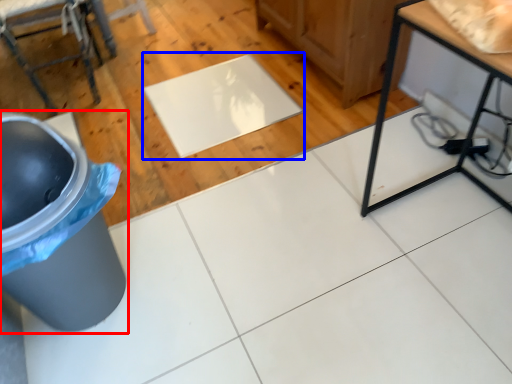
Question: Which point is further to the camera, waste container (highlighted by a red box) or mat (highlighted by a blue box)?

Choices:
 (A) waste container
 (B) mat

Answer: (B)